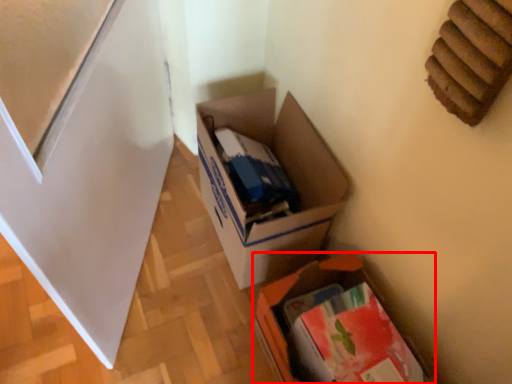
Question: From the image, what is the correct spatial relationship of box (annotated by the red box) in relation to box?

Choices:
 (A) right
 (B) left

Answer: (A)